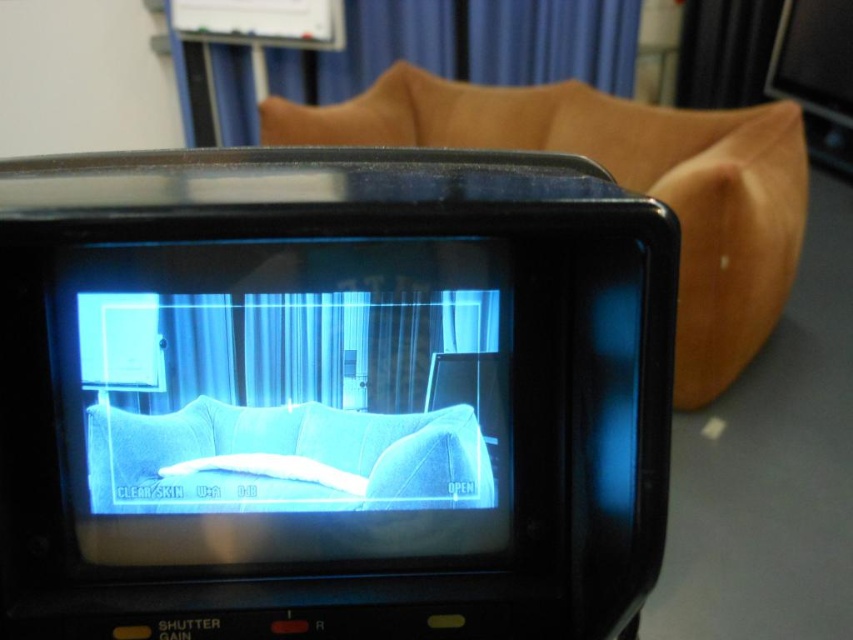
Can you confirm if black plastic video camera at center is bigger than brown leather couch at upper center?

No.

Is black plastic video camera at center positioned in front of brown leather couch at upper center?

→ Yes, it is.

You are a GUI agent. You are given a task and a screenshot of the screen. Output one action in this format:
    pyautogui.click(x=<x>, y=<y>)
    Task: Click on the black plastic video camera at center
    The height and width of the screenshot is (640, 853).
    Given the screenshot: What is the action you would take?
    pyautogui.click(x=329, y=396)

Locate an element on the screen. This screenshot has width=853, height=640. black plastic video camera at center is located at coordinates (329, 396).

Is black plastic video camera at center taller than blue fabric couch at center?

Yes.

Does black plastic video camera at center have a larger size compared to blue fabric couch at center?

Yes.

The width and height of the screenshot is (853, 640). I want to click on black plastic video camera at center, so click(329, 396).

Locate an element on the screen. The width and height of the screenshot is (853, 640). black plastic video camera at center is located at coordinates (329, 396).

Does blue fabric couch at center come in front of brown leather couch at upper center?

Yes, blue fabric couch at center is closer to the viewer.

Who is shorter, blue fabric couch at center or brown leather couch at upper center?

blue fabric couch at center

Identify the location of blue fabric couch at center. (289, 400).

The image size is (853, 640). I want to click on blue fabric couch at center, so click(289, 400).